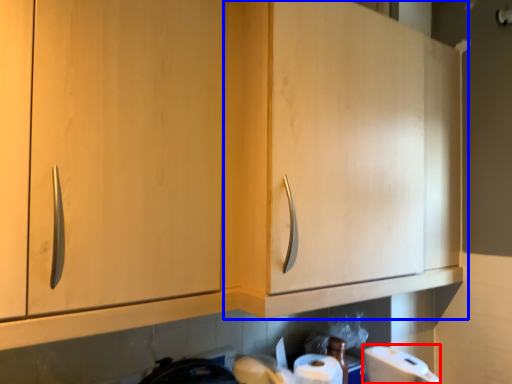
Question: Which object appears closest to the camera in this image, toilet paper (highlighted by a red box) or cabinetry (highlighted by a blue box)?

Choices:
 (A) toilet paper
 (B) cabinetry

Answer: (B)